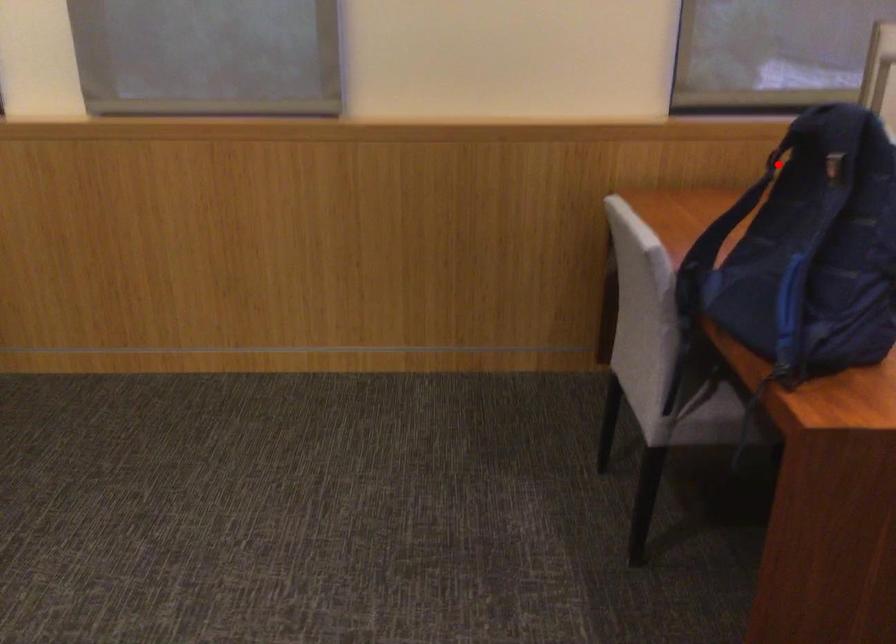
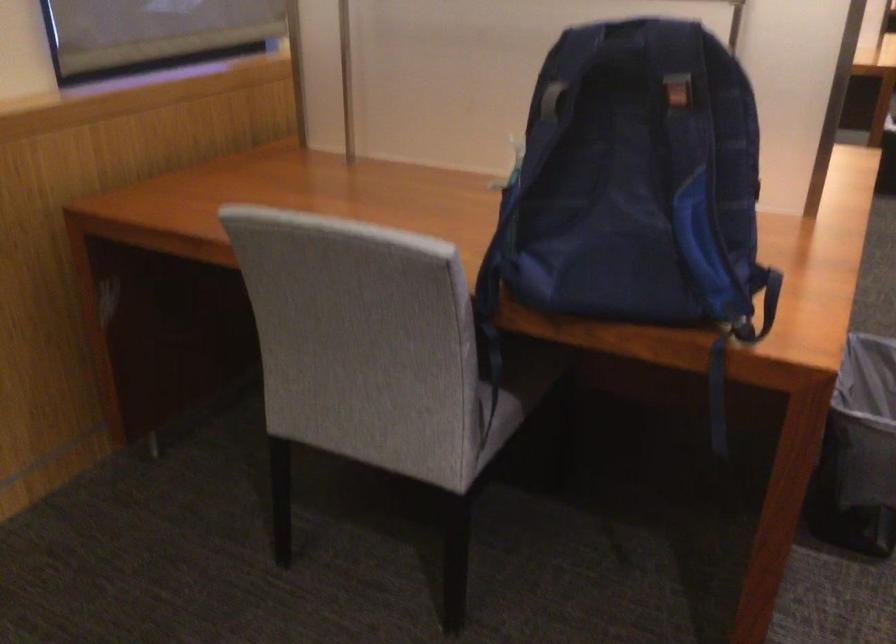
Where in the second image is the point corresponding to the highlighted location from the first image?

(552, 100)